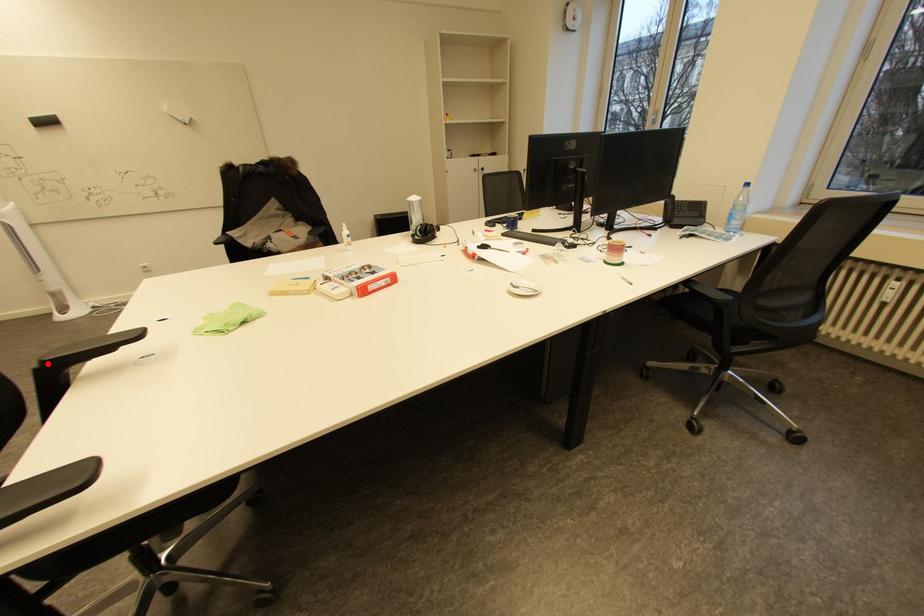
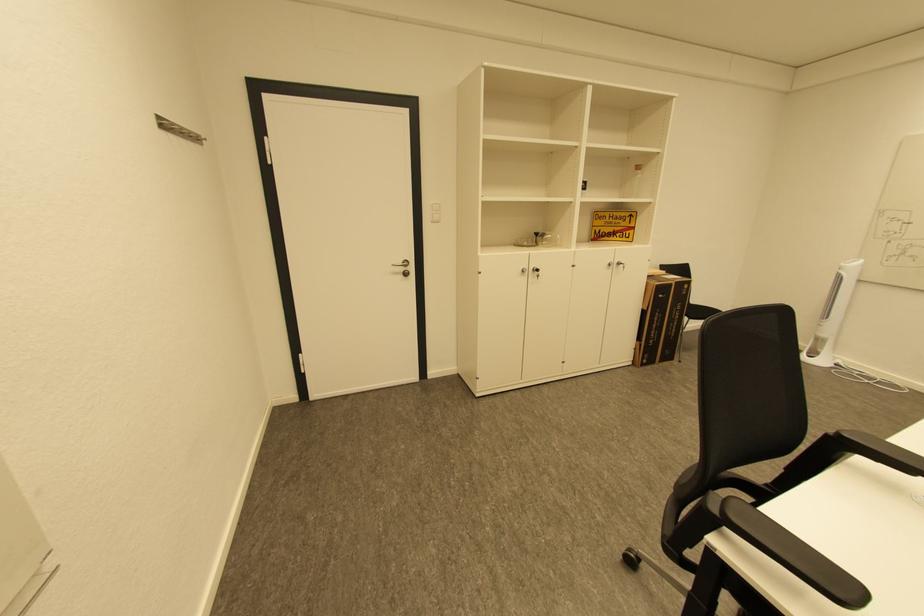
Question: I am providing you with two images of the same scene from different viewpoints. A red point is marked on the first image. Can you still see the location of the red point in image 2?

Choices:
 (A) Yes
 (B) No

Answer: (A)